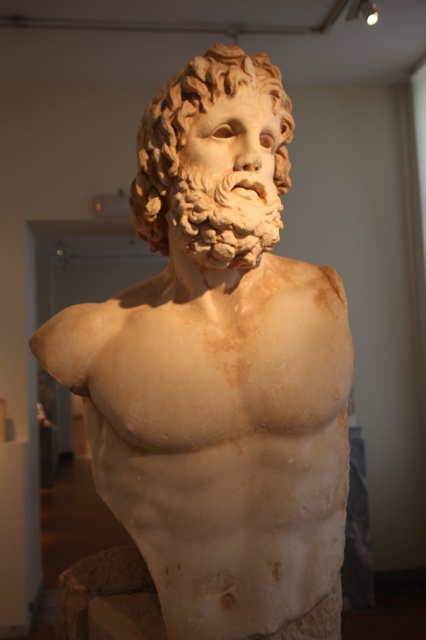
Does white marble bust at center come in front of white marble head at center?

Yes, it is in front of white marble head at center.

Can you confirm if white marble bust at center is shorter than white marble head at center?

No, white marble bust at center is not shorter than white marble head at center.

This screenshot has width=426, height=640. What do you see at coordinates (219, 371) in the screenshot?
I see `white marble bust at center` at bounding box center [219, 371].

The width and height of the screenshot is (426, 640). What are the coordinates of `white marble bust at center` in the screenshot? It's located at (219, 371).